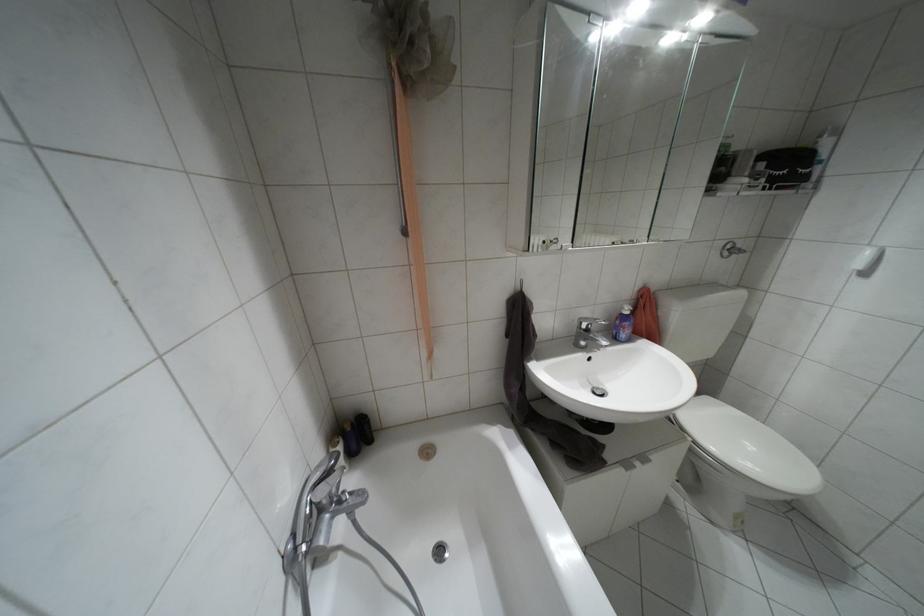
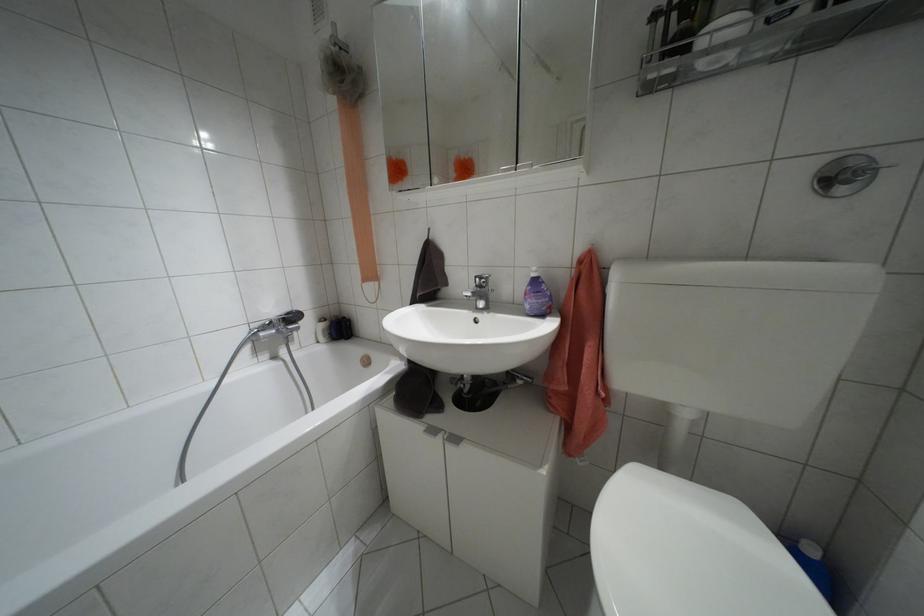
Find the pixel in the second image that matches pixel 626 312 in the first image.

(532, 274)